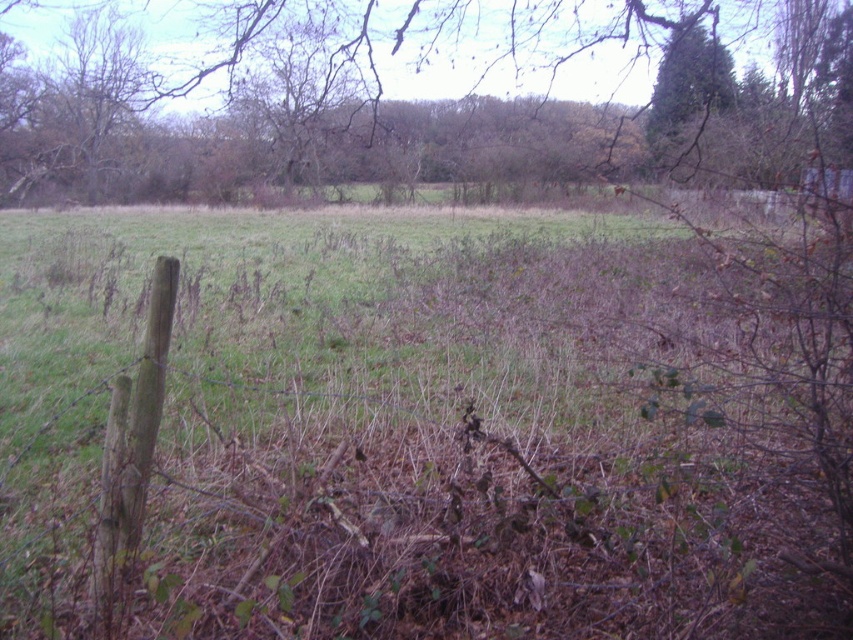
Is point (224, 84) positioned after point (701, 93)?

That is True.

Can you confirm if brown leafy tree at upper center is bigger than green textured tree at upper right?

Yes, brown leafy tree at upper center is bigger than green textured tree at upper right.

What are the coordinates of `brown leafy tree at upper center` in the screenshot? It's located at (416, 100).